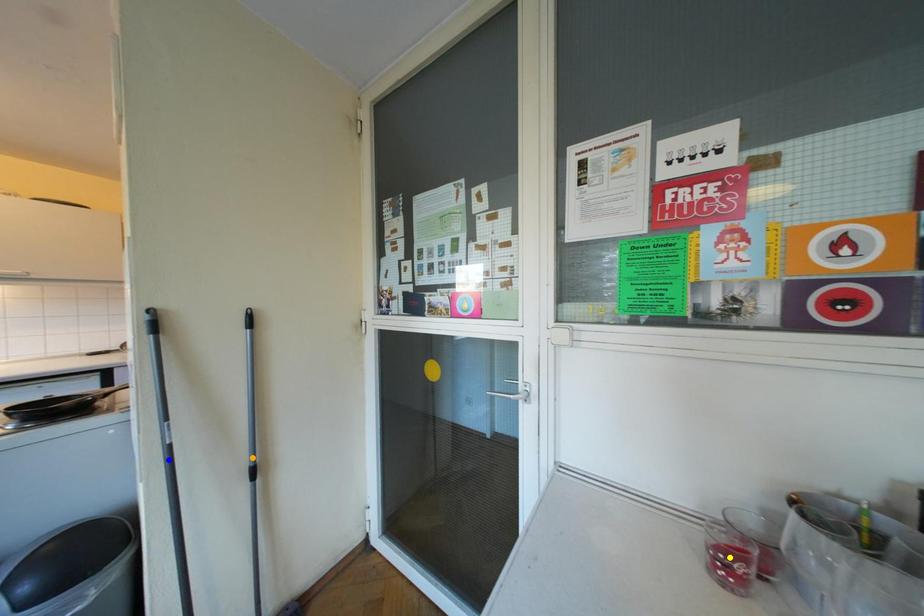
Order these from nearest to farthest:
1. yellow point
2. blue point
3. orange point

1. yellow point
2. blue point
3. orange point